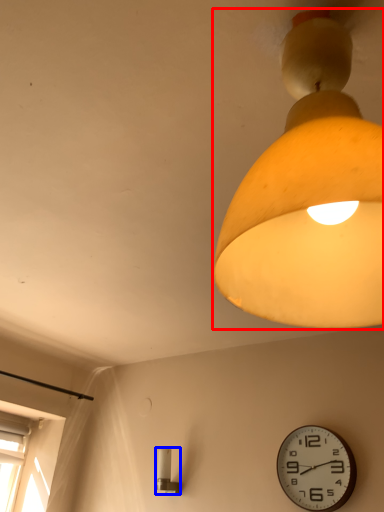
Question: Which point is further to the camera, lamp (highlighted by a red box) or lamp (highlighted by a blue box)?

Choices:
 (A) lamp
 (B) lamp

Answer: (B)